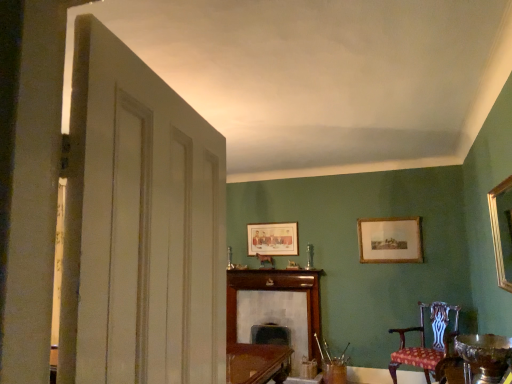
Question: Is shiny silver bowl at lower right completely or partially outside of wooden fireplace at center?

Choices:
 (A) yes
 (B) no

Answer: (A)

Question: From the image's perspective, is shiny silver bowl at lower right below wooden fireplace at center?

Choices:
 (A) yes
 (B) no

Answer: (B)

Question: Could you tell me if shiny silver bowl at lower right is facing wooden fireplace at center?

Choices:
 (A) no
 (B) yes

Answer: (A)

Question: Does shiny silver bowl at lower right have a greater height compared to wooden fireplace at center?

Choices:
 (A) no
 (B) yes

Answer: (A)

Question: From the image's perspective, is shiny silver bowl at lower right above wooden fireplace at center?

Choices:
 (A) yes
 (B) no

Answer: (A)

Question: Considering the relative positions of shiny silver bowl at lower right and wooden fireplace at center in the image provided, is shiny silver bowl at lower right in front of wooden fireplace at center?

Choices:
 (A) yes
 (B) no

Answer: (A)

Question: Are shiny silver bowl at lower right and matte wooden picture frame at center, placed as the first picture frame when sorted from back to front, beside each other?

Choices:
 (A) no
 (B) yes

Answer: (A)

Question: From the image's perspective, is shiny silver bowl at lower right on top of matte wooden picture frame at center, the 3th picture frame positioned from the right?

Choices:
 (A) yes
 (B) no

Answer: (B)

Question: Can you confirm if shiny silver bowl at lower right is taller than matte wooden picture frame at center, placed as the first picture frame when sorted from back to front?

Choices:
 (A) yes
 (B) no

Answer: (B)

Question: Is shiny silver bowl at lower right facing away from matte wooden picture frame at center, marked as the 1th picture frame in a left-to-right arrangement?

Choices:
 (A) no
 (B) yes

Answer: (A)

Question: Does shiny silver bowl at lower right have a lesser height compared to matte wooden picture frame at center, placed as the 3th picture frame when sorted from front to back?

Choices:
 (A) yes
 (B) no

Answer: (A)

Question: From a real-world perspective, is shiny silver bowl at lower right positioned over matte wooden picture frame at center, the 3th picture frame positioned from the right, based on gravity?

Choices:
 (A) no
 (B) yes

Answer: (A)

Question: Would you say patterned fabric chair at lower right is a long distance from matte wooden picture frame at center, the 3th picture frame positioned from the right?

Choices:
 (A) yes
 (B) no

Answer: (A)